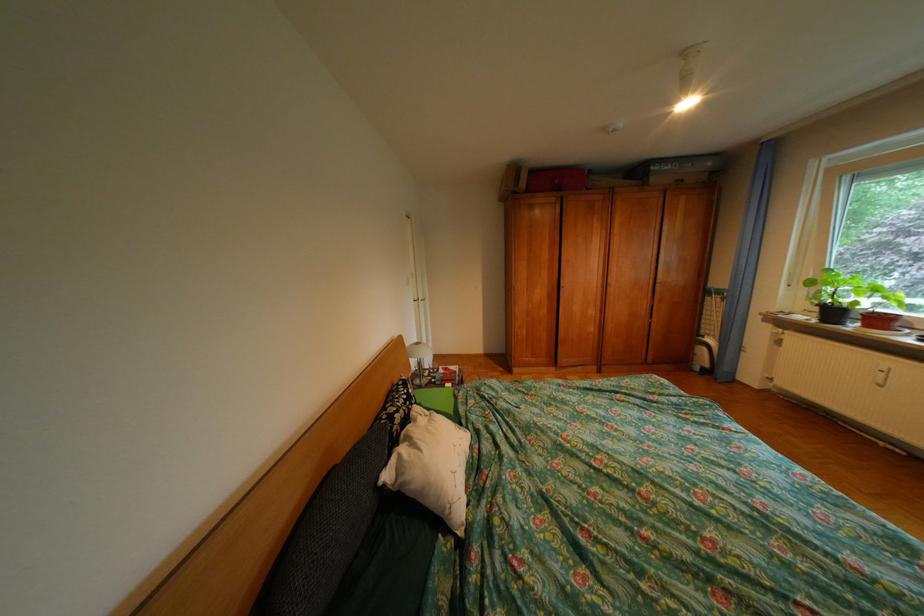
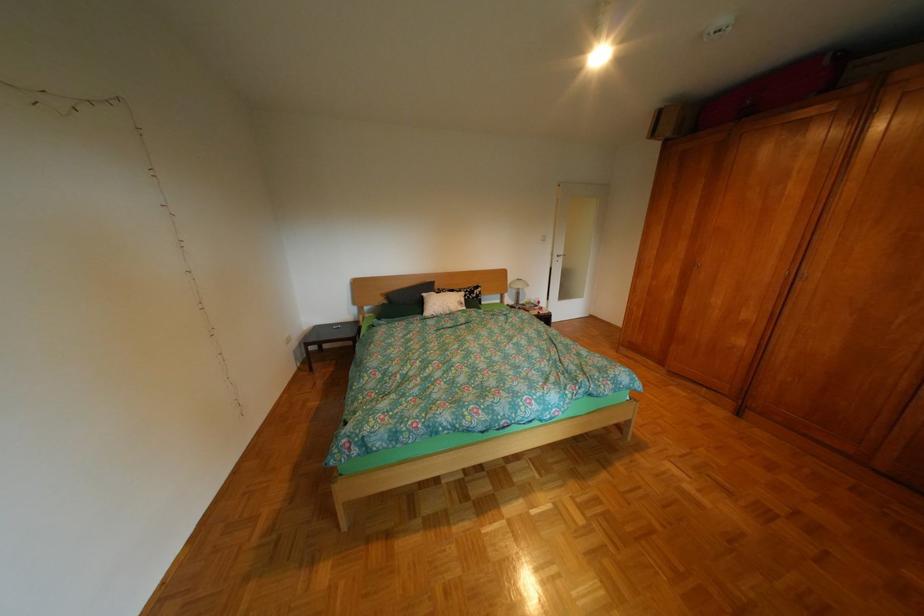
Where in the second image is the point corresponding to the point at 402,477 from the first image?

(439, 294)